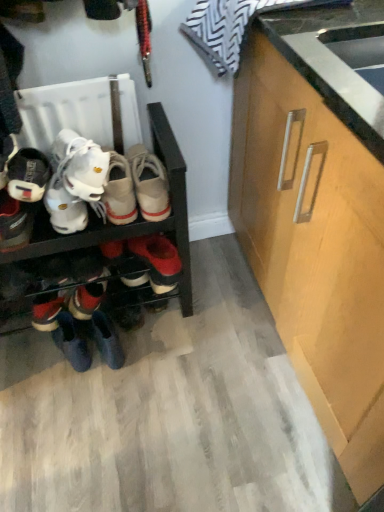
This screenshot has height=512, width=384. I want to click on matte black sneaker at left, which is the 2th footwear from bottom to top, so click(14, 223).

What do you see at coordinates (14, 223) in the screenshot?
I see `matte black sneaker at left, which is the second footwear from top to bottom` at bounding box center [14, 223].

Measure the distance between point (6, 149) and camera.

Point (6, 149) is 3.31 feet away from camera.

Where is `light wood cabinet at right`? The height and width of the screenshot is (512, 384). light wood cabinet at right is located at coordinates [x=315, y=239].

Where is `wooden shoe rack at center`? The width and height of the screenshot is (384, 512). wooden shoe rack at center is located at coordinates (129, 224).

Does light wood cabinet at right have a greater width compared to wooden shoe rack at center?

Indeed, light wood cabinet at right has a greater width compared to wooden shoe rack at center.

From the image's perspective, who appears lower, light wood cabinet at right or wooden shoe rack at center?

wooden shoe rack at center, from the image's perspective.

From the picture: From a real-world perspective, is light wood cabinet at right physically located above or below wooden shoe rack at center?

light wood cabinet at right is situated higher than wooden shoe rack at center in the real world.

Is light wood cabinet at right to the left of wooden shoe rack at center from the viewer's perspective?

No.

Is matte black sneaker at left, which is the second footwear from top to bottom, wider or thinner than matte black shoe at left, marked as the 3th footwear in a bottom-to-top arrangement?

Clearly, matte black sneaker at left, which is the second footwear from top to bottom, has more width compared to matte black shoe at left, marked as the 3th footwear in a bottom-to-top arrangement.

Which of these two, matte black sneaker at left, which is the 2th footwear from bottom to top, or matte black shoe at left, the first footwear positioned from the top, is bigger?

matte black sneaker at left, which is the 2th footwear from bottom to top, is bigger.

Is matte black sneaker at left, which is the 2th footwear from bottom to top, aimed at matte black shoe at left, marked as the 3th footwear in a bottom-to-top arrangement?

No, matte black sneaker at left, which is the 2th footwear from bottom to top, does not turn towards matte black shoe at left, marked as the 3th footwear in a bottom-to-top arrangement.

Could you measure the distance between matte black sneaker at left, which is the second footwear from top to bottom, and matte black shoe at left, marked as the 3th footwear in a bottom-to-top arrangement?

3.71 inches.

Can you tell me how much wooden shoe rack at center and matte black sneaker at left, which is the 2th footwear from bottom to top, differ in facing direction?

There is a 0.000559-degree angle between the facing directions of wooden shoe rack at center and matte black sneaker at left, which is the 2th footwear from bottom to top.

Between wooden shoe rack at center and matte black sneaker at left, which is the 2th footwear from bottom to top, which one has more height?

Standing taller between the two is wooden shoe rack at center.

In the scene shown: Can we say wooden shoe rack at center lies outside matte black sneaker at left, which is the 2th footwear from bottom to top?

Absolutely, wooden shoe rack at center is external to matte black sneaker at left, which is the 2th footwear from bottom to top.

Measure the distance from wooden shoe rack at center to matte black sneaker at left, which is the 2th footwear from bottom to top.

wooden shoe rack at center is 26.90 centimeters from matte black sneaker at left, which is the 2th footwear from bottom to top.

Could you tell me if leather boot at lower left, which appears as the third footwear when viewed from the top, is facing light wood cabinet at right?

No, leather boot at lower left, which appears as the third footwear when viewed from the top, does not turn towards light wood cabinet at right.

From a real-world perspective, is leather boot at lower left, the first footwear positioned from the bottom, physically above light wood cabinet at right?

Incorrect, from a real-world perspective, leather boot at lower left, the first footwear positioned from the bottom, is lower than light wood cabinet at right.

Considering the positions of points (79, 309) and (341, 191), is point (79, 309) farther from camera compared to point (341, 191)?

Yes, point (79, 309) is farther from viewer.

From the light wood cabinet at right, count the 1st footwear to the left and point to it. Please provide its 2D coordinates.

[(88, 296)]

Can you confirm if wooden shoe rack at center is positioned to the right of matte black shoe at left, marked as the 3th footwear in a bottom-to-top arrangement?

Indeed, wooden shoe rack at center is positioned on the right side of matte black shoe at left, marked as the 3th footwear in a bottom-to-top arrangement.

From the image's perspective, would you say wooden shoe rack at center is shown under matte black shoe at left, the first footwear positioned from the top?

Yes, from the image's perspective, wooden shoe rack at center is beneath matte black shoe at left, the first footwear positioned from the top.

Which object is more forward, wooden shoe rack at center or matte black shoe at left, the first footwear positioned from the top?

Positioned in front is wooden shoe rack at center.

Could you tell me if wooden shoe rack at center is turned towards matte black shoe at left, the first footwear positioned from the top?

No, wooden shoe rack at center is not oriented towards matte black shoe at left, the first footwear positioned from the top.

Considering the sizes of objects light wood cabinet at right and matte black shoe at left, marked as the 3th footwear in a bottom-to-top arrangement, in the image provided, who is smaller, light wood cabinet at right or matte black shoe at left, marked as the 3th footwear in a bottom-to-top arrangement,?

matte black shoe at left, marked as the 3th footwear in a bottom-to-top arrangement.

From the image's perspective, between light wood cabinet at right and matte black shoe at left, the first footwear positioned from the top, who is located below?

light wood cabinet at right.

In terms of height, does leather boot at lower left, the first footwear positioned from the bottom, look taller or shorter compared to wooden shoe rack at center?

In the image, leather boot at lower left, the first footwear positioned from the bottom, appears to be shorter than wooden shoe rack at center.

Consider the image. Between leather boot at lower left, which appears as the third footwear when viewed from the top, and wooden shoe rack at center, which one has smaller width?

leather boot at lower left, which appears as the third footwear when viewed from the top, is thinner.

From a real-world perspective, relative to wooden shoe rack at center, is leather boot at lower left, the first footwear positioned from the bottom, vertically above or below?

In terms of real-world spatial position, leather boot at lower left, the first footwear positioned from the bottom, is below wooden shoe rack at center.

Where is `cabinetry above the wooden shoe rack at center (from a real-world perspective)`? This screenshot has height=512, width=384. cabinetry above the wooden shoe rack at center (from a real-world perspective) is located at coordinates (315, 239).

Locate an element on the screen. footwear in front of the matte black sneaker at left, which is the 2th footwear from bottom to top is located at coordinates (6, 157).

From the image, which object appears to be nearer to wooden shoe rack at center, leather boot at lower left, the first footwear positioned from the bottom, or light wood cabinet at right?

leather boot at lower left, the first footwear positioned from the bottom, is positioned closer to the anchor wooden shoe rack at center.

Based on their spatial positions, is light wood cabinet at right or matte black sneaker at left, which is the 2th footwear from bottom to top, further from leather boot at lower left, the first footwear positioned from the bottom?

→ light wood cabinet at right.

Looking at the image, which one is located closer to light wood cabinet at right, leather boot at lower left, which appears as the third footwear when viewed from the top, or matte black shoe at left, marked as the 3th footwear in a bottom-to-top arrangement?

leather boot at lower left, which appears as the third footwear when viewed from the top, is positioned closer to the anchor light wood cabinet at right.

When comparing their distances from light wood cabinet at right, does matte black shoe at left, marked as the 3th footwear in a bottom-to-top arrangement, or wooden shoe rack at center seem closer?

wooden shoe rack at center lies closer to light wood cabinet at right than the other object.

Based on their spatial positions, is light wood cabinet at right or matte black sneaker at left, which is the 2th footwear from bottom to top, further from matte black shoe at left, the first footwear positioned from the top?

light wood cabinet at right is positioned further to the anchor matte black shoe at left, the first footwear positioned from the top.

Which object lies nearer to the anchor point light wood cabinet at right, leather boot at lower left, the first footwear positioned from the bottom, or wooden shoe rack at center?

The object closer to light wood cabinet at right is wooden shoe rack at center.

Looking at the image, which one is located further to light wood cabinet at right, wooden shoe rack at center or matte black sneaker at left, which is the 2th footwear from bottom to top?

Among the two, matte black sneaker at left, which is the 2th footwear from bottom to top, is located further to light wood cabinet at right.

Which object lies further to the anchor point wooden shoe rack at center, matte black shoe at left, the first footwear positioned from the top, or light wood cabinet at right?

The object further to wooden shoe rack at center is light wood cabinet at right.

Locate an element on the screen. This screenshot has height=512, width=384. shelf between matte black sneaker at left, which is the 2th footwear from bottom to top, and light wood cabinet at right from left to right is located at coordinates (129, 224).

Find the location of `footwear located between matte black sneaker at left, which is the 2th footwear from bottom to top, and light wood cabinet at right in the left-right direction`. footwear located between matte black sneaker at left, which is the 2th footwear from bottom to top, and light wood cabinet at right in the left-right direction is located at coordinates (88, 296).

The height and width of the screenshot is (512, 384). Find the location of `footwear between matte black shoe at left, marked as the 3th footwear in a bottom-to-top arrangement, and wooden shoe rack at center vertically`. footwear between matte black shoe at left, marked as the 3th footwear in a bottom-to-top arrangement, and wooden shoe rack at center vertically is located at coordinates point(14,223).

Locate an element on the screen. Image resolution: width=384 pixels, height=512 pixels. footwear that lies between matte black shoe at left, marked as the 3th footwear in a bottom-to-top arrangement, and leather boot at lower left, the first footwear positioned from the bottom, from top to bottom is located at coordinates (14, 223).